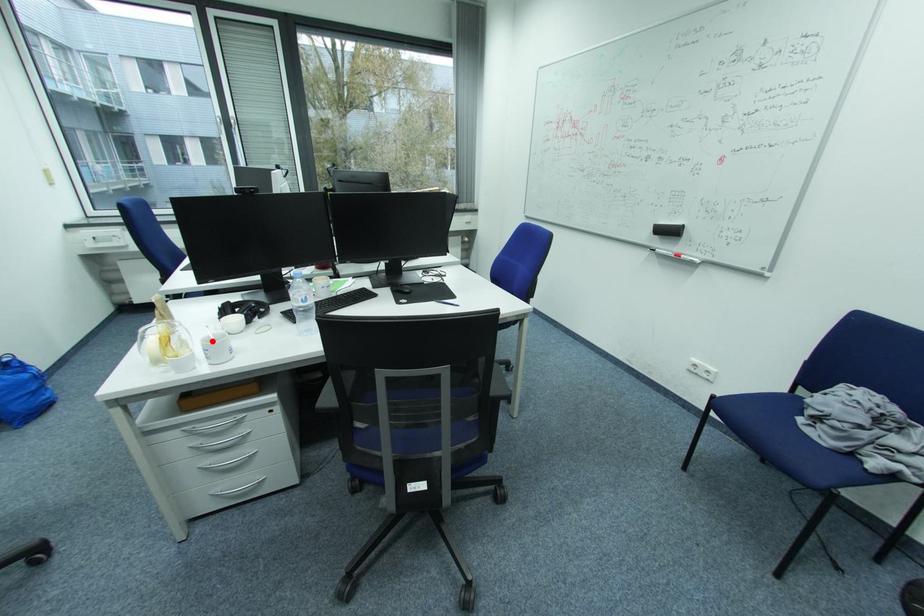
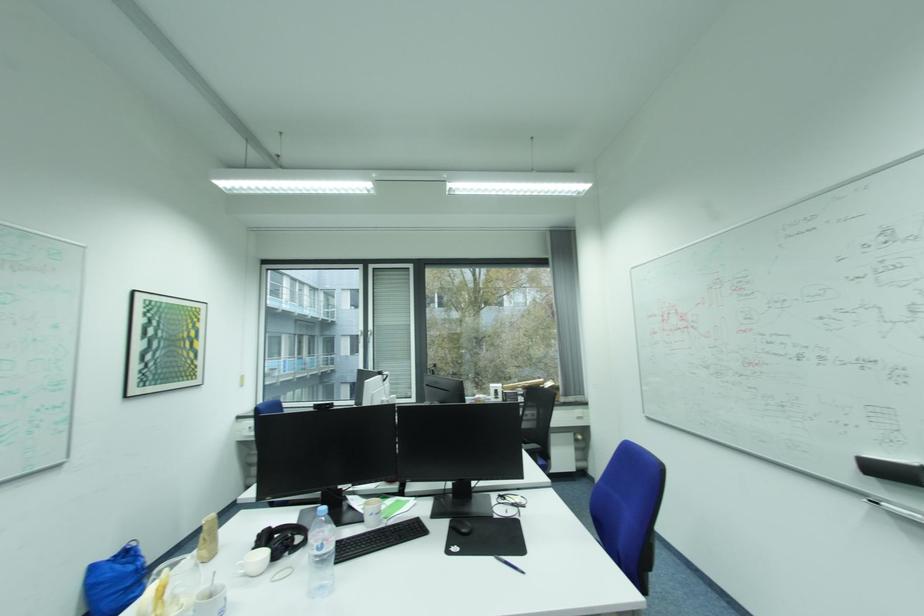
Question: I am providing you with two images of the same scene from different viewpoints. In image1, a red point is highlighted. Considering the same 3D point in image2, which of the following is correct?

Choices:
 (A) It is closer
 (B) It is farther

Answer: (A)